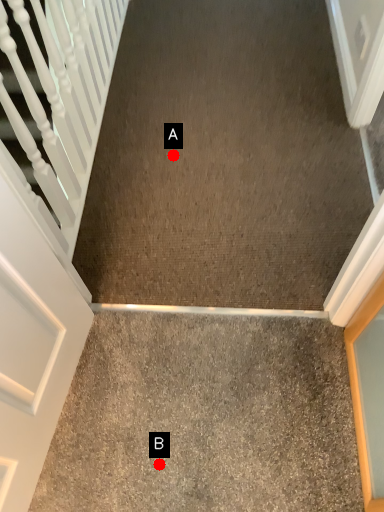
Question: Two points are circled on the image, labeled by A and B beside each circle. Which point appears closest to the camera in this image?

Choices:
 (A) A is closer
 (B) B is closer

Answer: (B)